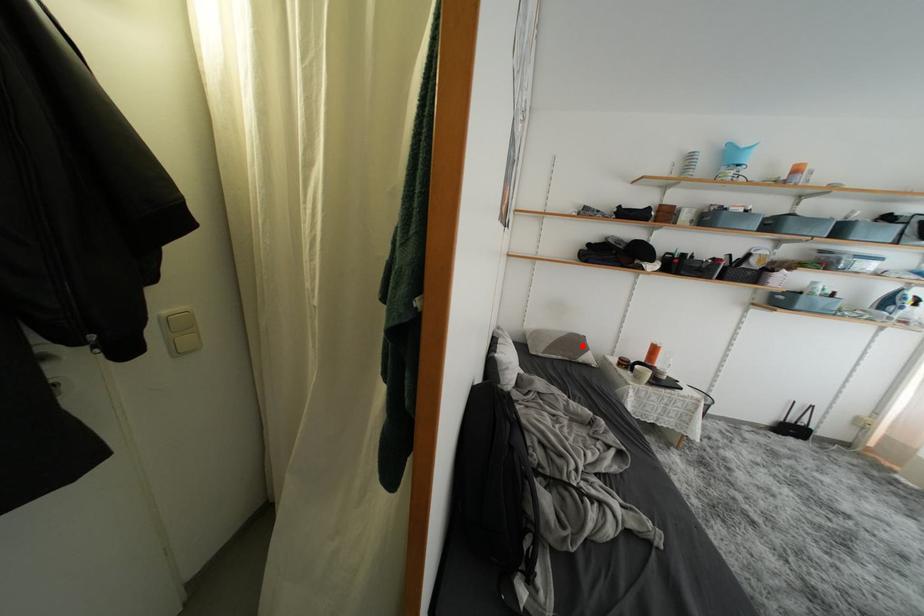
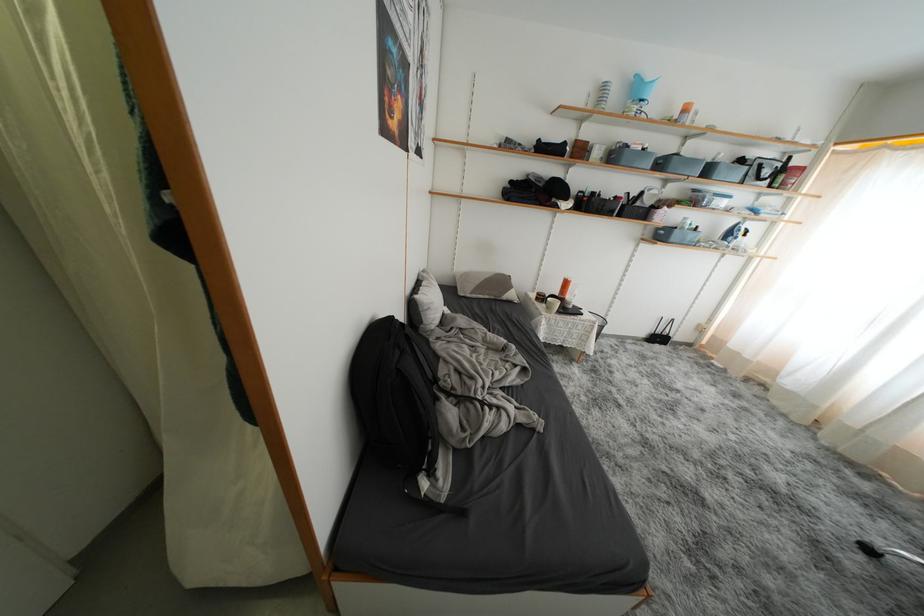
Question: I am providing you with two images of the same scene from different viewpoints. Image1 has a red point marked. In image2, the corresponding 3D location appears at what relative position? Reply with the corresponding letter.

Choices:
 (A) Closer
 (B) Farther

Answer: (A)